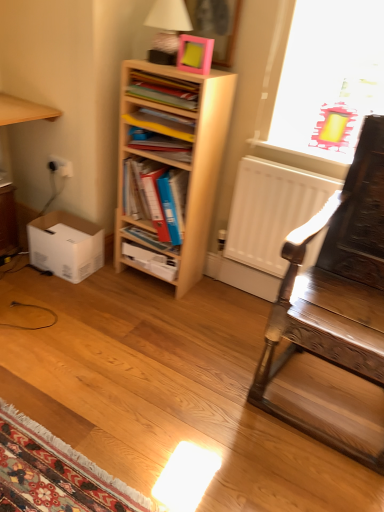
Identify the location of vacant point above white matte radiator at center (from a real-world perspective). (307, 163).